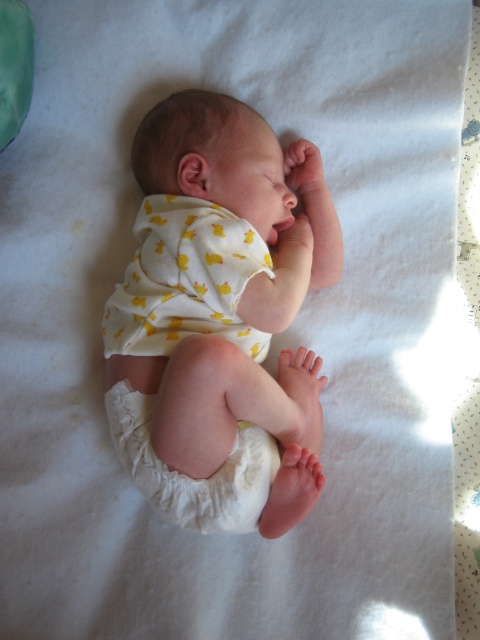
Question: Is white cotton newborn at center smaller than white cloth diaper at lower center?

Choices:
 (A) no
 (B) yes

Answer: (A)

Question: Considering the relative positions of white cotton newborn at center and white cloth diaper at lower center in the image provided, where is white cotton newborn at center located with respect to white cloth diaper at lower center?

Choices:
 (A) right
 (B) left

Answer: (A)

Question: Which point is closer to the camera?

Choices:
 (A) (213, 131)
 (B) (144, 490)

Answer: (B)

Question: Which point is closer to the camera taking this photo?

Choices:
 (A) [310, 428]
 (B) [143, 468]

Answer: (B)

Question: Observing the image, what is the correct spatial positioning of white cotton newborn at center in reference to white cloth diaper at lower center?

Choices:
 (A) above
 (B) below

Answer: (A)

Question: Which point is closer to the camera?

Choices:
 (A) (182, 522)
 (B) (308, 481)

Answer: (A)